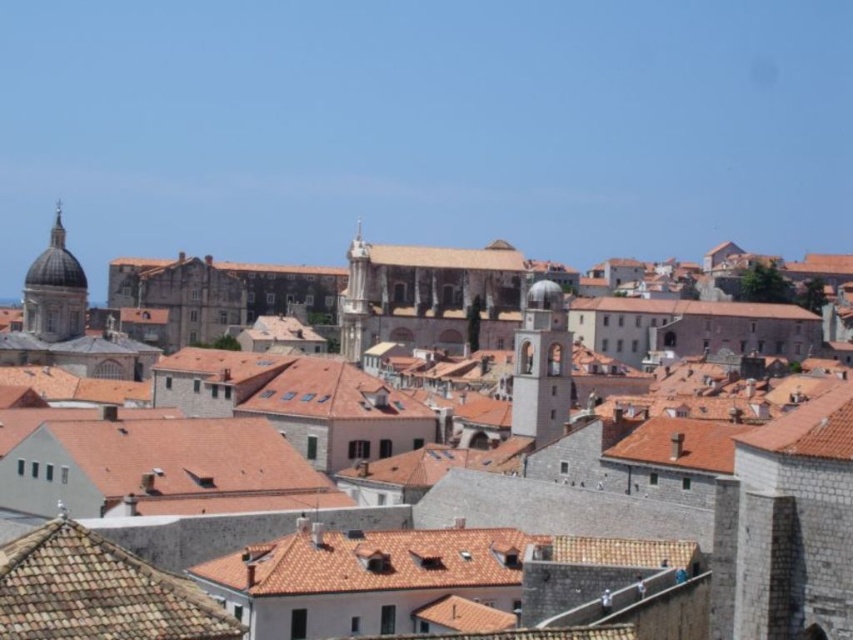
Question: In this image, where is brown tile roof at lower left located relative to matte gray dome at upper left?

Choices:
 (A) below
 (B) above

Answer: (A)

Question: Which object appears farthest from the camera in this image?

Choices:
 (A) smooth stone tower at center
 (B) smooth stone bell tower at center
 (C) brown tile roof at center
 (D) matte stone town at center

Answer: (C)

Question: Which of these objects is positioned closest to the matte stone town at center?

Choices:
 (A) matte gray dome at upper left
 (B) brown tile roof at lower left

Answer: (B)

Question: Which point is farther from the camera taking this photo?

Choices:
 (A) (811, 518)
 (B) (44, 593)

Answer: (A)

Question: Is matte stone town at center closer to the viewer compared to brown tile roof at lower left?

Choices:
 (A) yes
 (B) no

Answer: (B)

Question: Observing the image, what is the correct spatial positioning of smooth stone bell tower at center in reference to matte gray dome at upper left?

Choices:
 (A) below
 (B) above

Answer: (A)